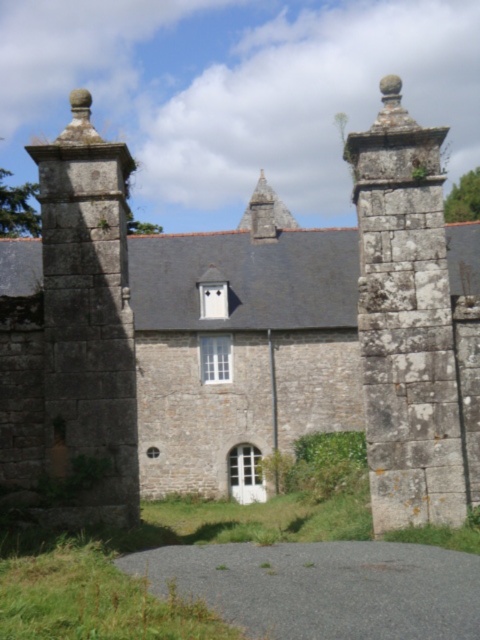
Question: Is rusty stone gatepost at right to the right of rustic stone tower at left from the viewer's perspective?

Choices:
 (A) yes
 (B) no

Answer: (A)

Question: Where is rusty stone gatepost at right located in relation to rustic stone tower at left in the image?

Choices:
 (A) above
 (B) below

Answer: (A)

Question: Which object is farther from the camera taking this photo?

Choices:
 (A) rustic stone tower at left
 (B) rusty stone gatepost at right

Answer: (A)

Question: Is the position of rusty stone gatepost at right less distant than that of rustic stone tower at left?

Choices:
 (A) yes
 (B) no

Answer: (A)

Question: Which point is closer to the camera?

Choices:
 (A) rusty stone gatepost at right
 (B) rustic stone tower at left

Answer: (A)